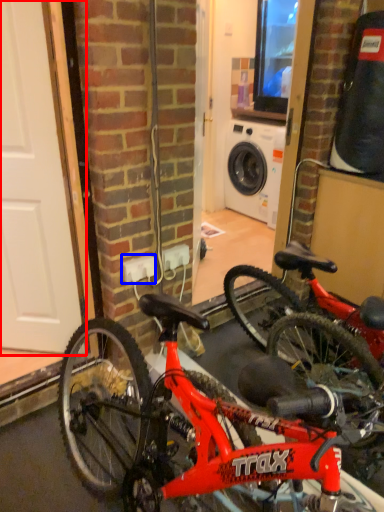
Question: Which object appears closest to the camera in this image, door (highlighted by a red box) or electric outlet (highlighted by a blue box)?

Choices:
 (A) door
 (B) electric outlet

Answer: (A)